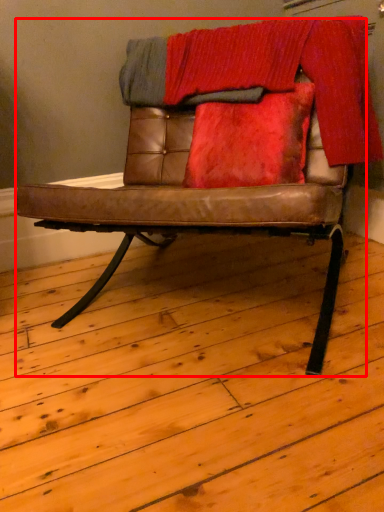
Question: From the image's perspective, what is the correct spatial positioning of chair (annotated by the red box) in reference to blanket?

Choices:
 (A) below
 (B) above

Answer: (A)